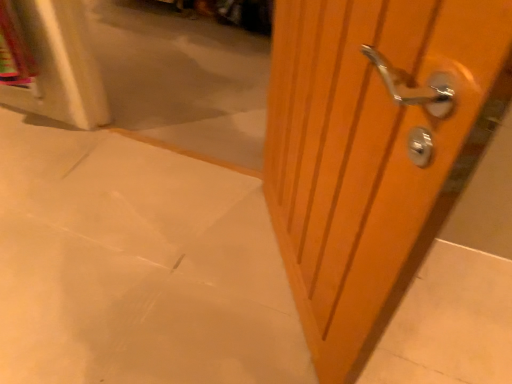
Question: Is wooden door handle at right oriented towards matte white concrete at center?

Choices:
 (A) no
 (B) yes

Answer: (B)

Question: Is wooden door handle at right facing away from matte white concrete at center?

Choices:
 (A) no
 (B) yes

Answer: (A)

Question: From a real-world perspective, is wooden door handle at right located higher than matte white concrete at center?

Choices:
 (A) no
 (B) yes

Answer: (B)

Question: Is wooden door handle at right wider than matte white concrete at center?

Choices:
 (A) yes
 (B) no

Answer: (B)

Question: From a real-world perspective, does wooden door handle at right sit lower than matte white concrete at center?

Choices:
 (A) yes
 (B) no

Answer: (B)

Question: Can you confirm if wooden door handle at right is positioned to the right of matte white concrete at center?

Choices:
 (A) yes
 (B) no

Answer: (A)

Question: Considering the relative sizes of matte white concrete at center and wooden door handle at right in the image provided, is matte white concrete at center thinner than wooden door handle at right?

Choices:
 (A) yes
 (B) no

Answer: (B)

Question: Is matte white concrete at center to the left of wooden door handle at right from the viewer's perspective?

Choices:
 (A) no
 (B) yes

Answer: (B)

Question: Is there a large distance between matte white concrete at center and wooden door handle at right?

Choices:
 (A) no
 (B) yes

Answer: (A)

Question: Does matte white concrete at center have a smaller size compared to wooden door handle at right?

Choices:
 (A) no
 (B) yes

Answer: (B)

Question: Is the depth of matte white concrete at center greater than that of wooden door handle at right?

Choices:
 (A) no
 (B) yes

Answer: (B)

Question: Is wooden door handle at right inside matte white concrete at center?

Choices:
 (A) no
 (B) yes

Answer: (A)

Question: From the image's perspective, relative to matte white concrete at center, is wooden door handle at right above or below?

Choices:
 (A) above
 (B) below

Answer: (A)